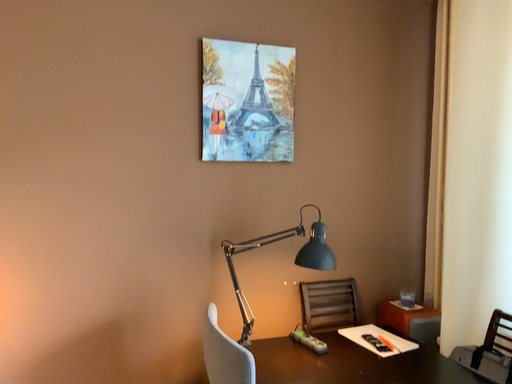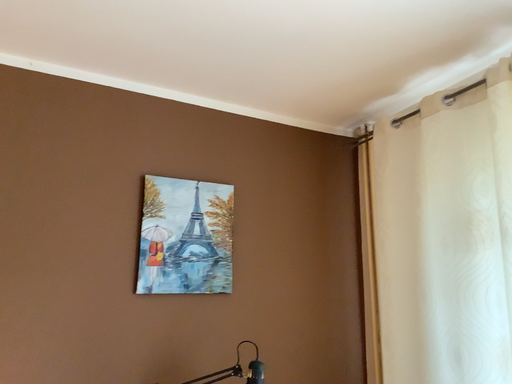
Question: How did the camera likely rotate when shooting the video?

Choices:
 (A) rotated left
 (B) rotated right

Answer: (B)